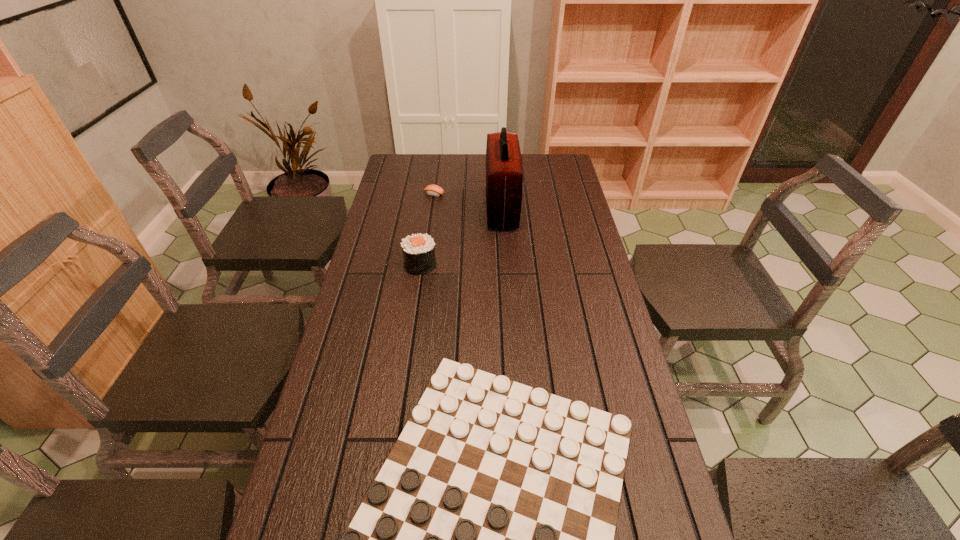
The width and height of the screenshot is (960, 540). What are the coordinates of `free space at the left edge` in the screenshot? It's located at [380, 218].

Find the location of a particular element. The height and width of the screenshot is (540, 960). free location at the right edge of the desktop is located at coordinates (617, 352).

Locate an element on the screen. This screenshot has height=540, width=960. vacant region at the far left corner of the desktop is located at coordinates (422, 154).

In the image, there is a desktop. Find the location of `free space at the far right corner`. free space at the far right corner is located at coordinates (566, 174).

Identify the location of free space between the tallest object and the shorter sushi. (468, 201).

At what (x,y) coordinates should I click in order to perform the action: click on vacant point located between the shorter sushi and the tallest object. Please return your answer as a coordinate pair (x, y). The height and width of the screenshot is (540, 960). Looking at the image, I should click on (468, 201).

You are a GUI agent. You are given a task and a screenshot of the screen. Output one action in this format:
    pyautogui.click(x=<x>, y=<y>)
    Task: Click on the empty location between the tallest object and the second tallest object
    The width and height of the screenshot is (960, 540).
    Given the screenshot: What is the action you would take?
    pyautogui.click(x=461, y=236)

The width and height of the screenshot is (960, 540). Identify the location of unoccupied area between the tallest object and the farther sushi. (468, 201).

Locate which object ranks second in proximity to the tallest object. Please provide its 2D coordinates. Your answer should be formatted as a tuple, i.e. [(x, y)], where the tuple contains the x and y coordinates of a point satisfying the conditions above.

[(418, 250)]

You are a GUI agent. You are given a task and a screenshot of the screen. Output one action in this format:
    pyautogui.click(x=<x>, y=<y>)
    Task: Click on the closest object relative to the nearest object
    The image size is (960, 540).
    Given the screenshot: What is the action you would take?
    pyautogui.click(x=418, y=250)